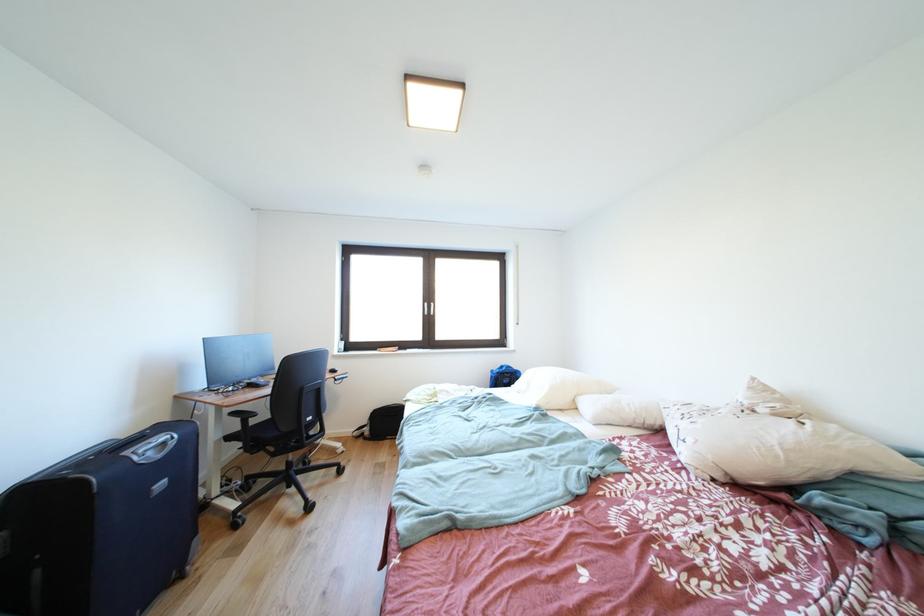
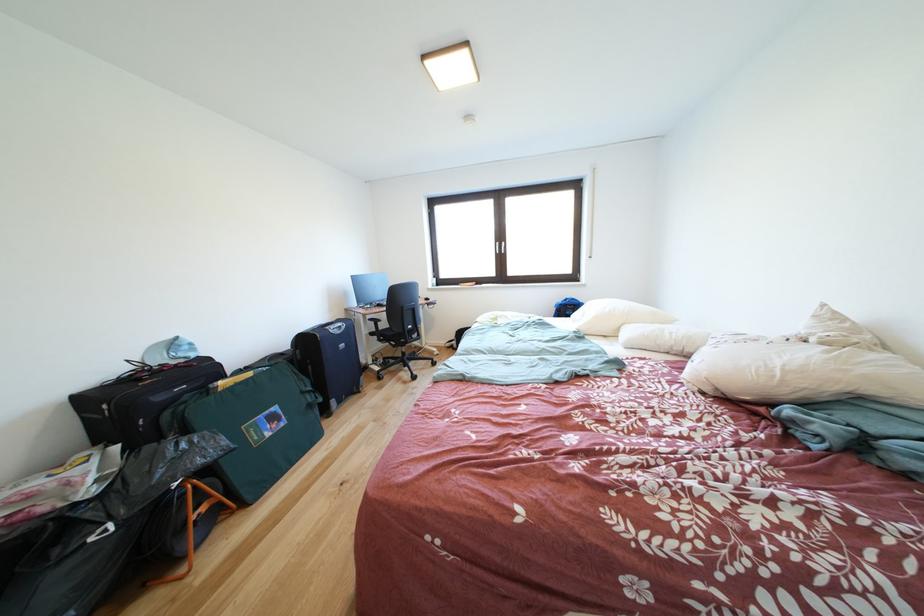
Question: The first image is from the beginning of the video and the second image is from the end. How did the camera likely rotate when shooting the video?

Choices:
 (A) Left
 (B) Right
 (C) Up
 (D) Down

Answer: (A)